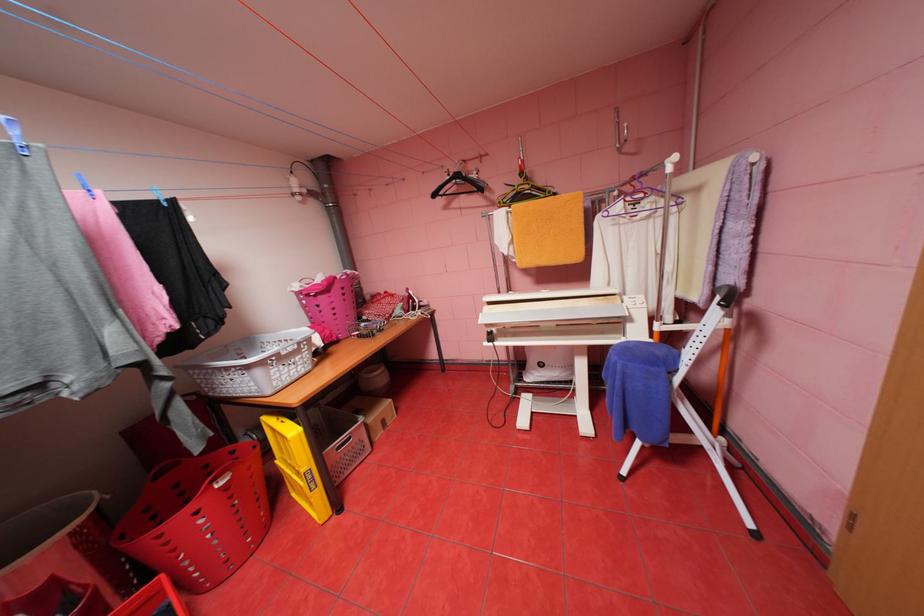
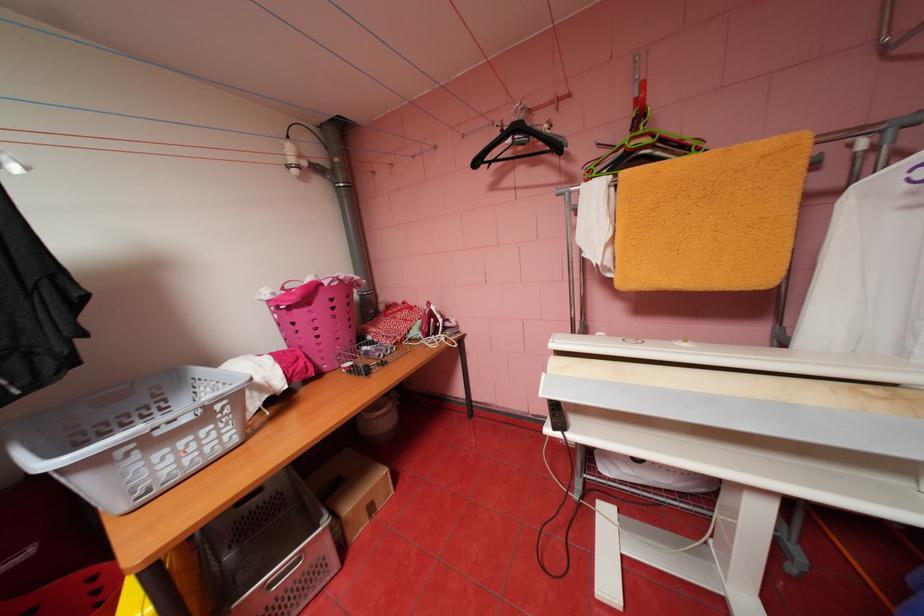
Where in the second image is the point corresponding to pixel 298 371 from the first image?

(187, 460)